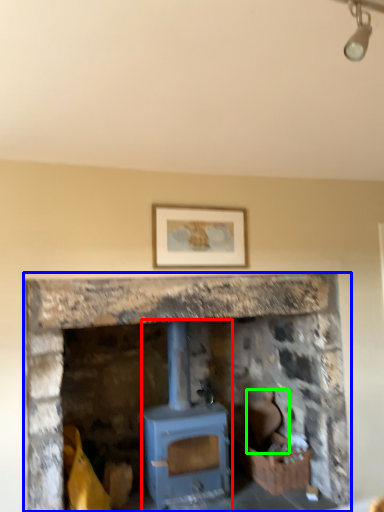
Question: Estimate the real-world distances between objects in this image. Which object is farther from wood burning stove (highlighted by a red box), fireplace (highlighted by a blue box) or chair (highlighted by a green box)?

Choices:
 (A) fireplace
 (B) chair

Answer: (B)